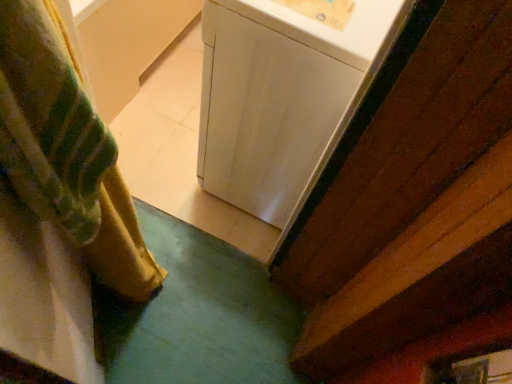
Question: Considering their positions, is white glossy washing machine at center located in front of or behind velvety green curtain at left?

Choices:
 (A) behind
 (B) front

Answer: (A)

Question: From their relative heights in the image, would you say white glossy washing machine at center is taller or shorter than velvety green curtain at left?

Choices:
 (A) short
 (B) tall

Answer: (A)

Question: Would you say white glossy washing machine at center is inside or outside velvety green curtain at left?

Choices:
 (A) inside
 (B) outside

Answer: (B)

Question: In terms of width, does velvety green curtain at left look wider or thinner when compared to white glossy washing machine at center?

Choices:
 (A) thin
 (B) wide

Answer: (A)

Question: Based on their sizes in the image, would you say velvety green curtain at left is bigger or smaller than white glossy washing machine at center?

Choices:
 (A) big
 (B) small

Answer: (B)

Question: Considering the positions of point (36, 198) and point (243, 150), is point (36, 198) closer or farther from the camera than point (243, 150)?

Choices:
 (A) farther
 (B) closer

Answer: (B)

Question: Is velvety green curtain at left spatially inside white glossy washing machine at center, or outside of it?

Choices:
 (A) inside
 (B) outside

Answer: (B)